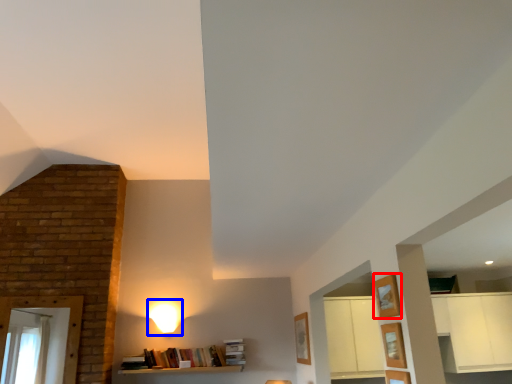
Question: Among these objects, which one is farthest to the camera, shelf (highlighted by a red box) or lamp (highlighted by a blue box)?

Choices:
 (A) shelf
 (B) lamp

Answer: (B)